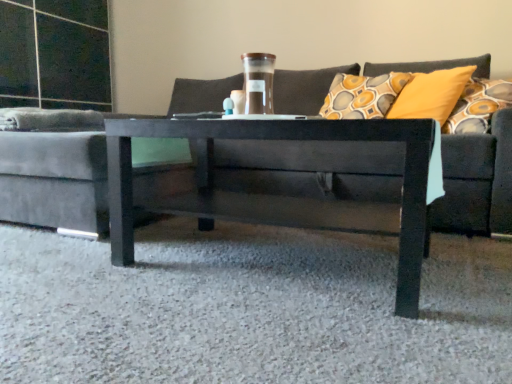
Question: Is dark gray fabric couch at center positioned far away from translucent glass jar at center?

Choices:
 (A) yes
 (B) no

Answer: (B)

Question: Is dark gray fabric couch at center taller than translucent glass jar at center?

Choices:
 (A) no
 (B) yes

Answer: (B)

Question: Is dark gray fabric couch at center wider than translucent glass jar at center?

Choices:
 (A) yes
 (B) no

Answer: (A)

Question: Could you tell me if dark gray fabric couch at center is facing translucent glass jar at center?

Choices:
 (A) yes
 (B) no

Answer: (A)

Question: From the image's perspective, is dark gray fabric couch at center under translucent glass jar at center?

Choices:
 (A) yes
 (B) no

Answer: (A)

Question: Is dark gray fabric couch at center positioned beyond the bounds of translucent glass jar at center?

Choices:
 (A) no
 (B) yes

Answer: (B)

Question: Is translucent glass jar at center positioned far away from dark gray fabric couch at center?

Choices:
 (A) no
 (B) yes

Answer: (A)

Question: Would you say translucent glass jar at center contains dark gray fabric couch at center?

Choices:
 (A) yes
 (B) no

Answer: (B)

Question: Can you confirm if translucent glass jar at center is bigger than dark gray fabric couch at center?

Choices:
 (A) no
 (B) yes

Answer: (A)

Question: Is translucent glass jar at center wider than dark gray fabric couch at center?

Choices:
 (A) no
 (B) yes

Answer: (A)

Question: Is translucent glass jar at center completely or partially outside of dark gray fabric couch at center?

Choices:
 (A) yes
 (B) no

Answer: (B)

Question: Considering the relative sizes of translucent glass jar at center and dark gray fabric couch at center in the image provided, is translucent glass jar at center smaller than dark gray fabric couch at center?

Choices:
 (A) no
 (B) yes

Answer: (B)

Question: From the image's perspective, does dark gray fabric couch at center appear lower than glossy black coffee table at center?

Choices:
 (A) no
 (B) yes

Answer: (A)